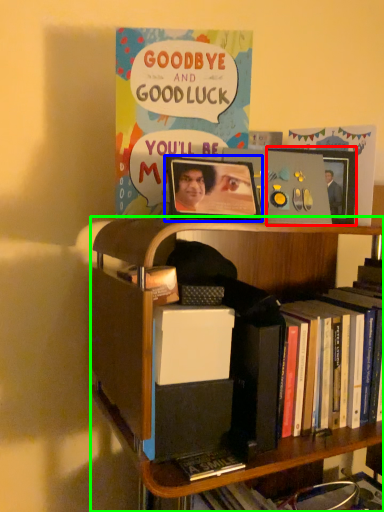
Question: Which object is positioned closest to picture frame (highlighted by a red box)? Select from picture frame (highlighted by a blue box) and bookcase (highlighted by a green box).

Choices:
 (A) picture frame
 (B) bookcase

Answer: (A)